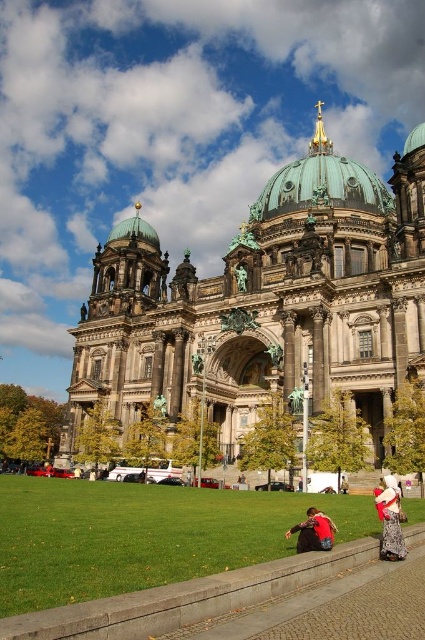
Can you confirm if dark gray stone church at center is bigger than patterned fabric dress at lower right?

Correct, dark gray stone church at center is larger in size than patterned fabric dress at lower right.

Is dark gray stone church at center wider than patterned fabric dress at lower right?

Yes, dark gray stone church at center is wider than patterned fabric dress at lower right.

Identify the location of dark gray stone church at center. (266, 301).

Looking at this image, can you confirm if green grass at lower center is positioned to the left of green copper dome at upper center?

Correct, you'll find green grass at lower center to the left of green copper dome at upper center.

Locate an element on the screen. Image resolution: width=425 pixels, height=640 pixels. green grass at lower center is located at coordinates (139, 536).

Is the position of dark gray stone church at center less distant than that of green copper dome at upper center?

Yes, dark gray stone church at center is in front of green copper dome at upper center.

Can you confirm if dark gray stone church at center is shorter than green copper dome at upper center?

In fact, dark gray stone church at center may be taller than green copper dome at upper center.

Is point (402, 225) positioned before point (299, 161)?

Yes.

The image size is (425, 640). Find the location of `dark gray stone church at center`. dark gray stone church at center is located at coordinates (266, 301).